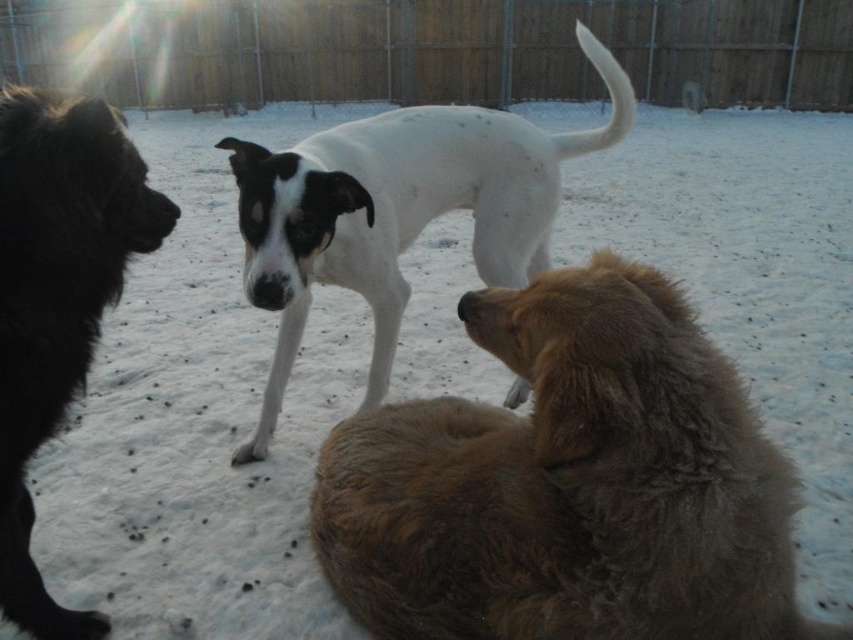
Does fuzzy brown dog at lower right appear over black fluffy dog at left?

Incorrect, fuzzy brown dog at lower right is not positioned above black fluffy dog at left.

Is point (683, 408) farther from viewer compared to point (18, 518)?

No.

This screenshot has height=640, width=853. I want to click on fuzzy brown dog at lower right, so click(567, 483).

Who is more forward, (608, 561) or (277, 177)?

Positioned in front is point (608, 561).

Which is more to the left, fuzzy brown dog at lower right or white smooth dog at center?

white smooth dog at center is more to the left.

In order to click on fuzzy brown dog at lower right in this screenshot , I will do `click(567, 483)`.

Does point (271, 392) lie behind point (55, 632)?

Yes, point (271, 392) is behind point (55, 632).

Does white smooth dog at center have a greater width compared to black fluffy dog at left?

Correct, the width of white smooth dog at center exceeds that of black fluffy dog at left.

Who is more forward, (401, 109) or (45, 422)?

Positioned in front is point (45, 422).

Image resolution: width=853 pixels, height=640 pixels. What are the coordinates of `white smooth dog at center` in the screenshot? It's located at (398, 211).